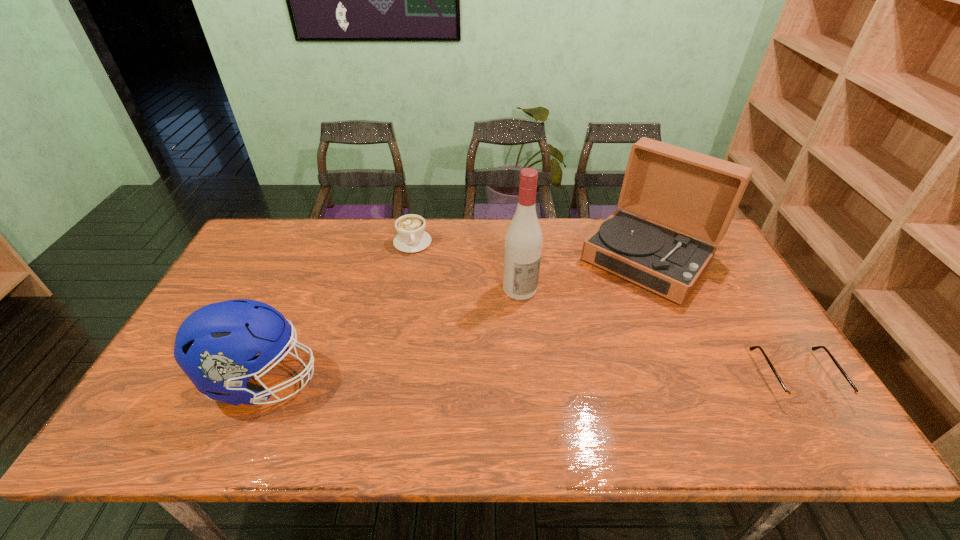
Where is `free spot between the shortest object and the fourth object from right to left`? The height and width of the screenshot is (540, 960). free spot between the shortest object and the fourth object from right to left is located at coordinates (604, 310).

This screenshot has width=960, height=540. What are the coordinates of `vacant area that lies between the shortest object and the third shortest object` in the screenshot? It's located at (529, 379).

You are a GUI agent. You are given a task and a screenshot of the screen. Output one action in this format:
    pyautogui.click(x=<x>, y=<y>)
    Task: Click on the vacant space that's between the third object from left to right and the fourth shortest object
    
    Given the screenshot: What is the action you would take?
    pyautogui.click(x=584, y=274)

The image size is (960, 540). In order to click on the fourth closest object to the tallest object in this screenshot , I will do `click(791, 397)`.

Identify which object is the second nearest to the second shortest object. Please provide its 2D coordinates. Your answer should be formatted as a tuple, i.e. [(x, y)], where the tuple contains the x and y coordinates of a point satisfying the conditions above.

[(215, 346)]